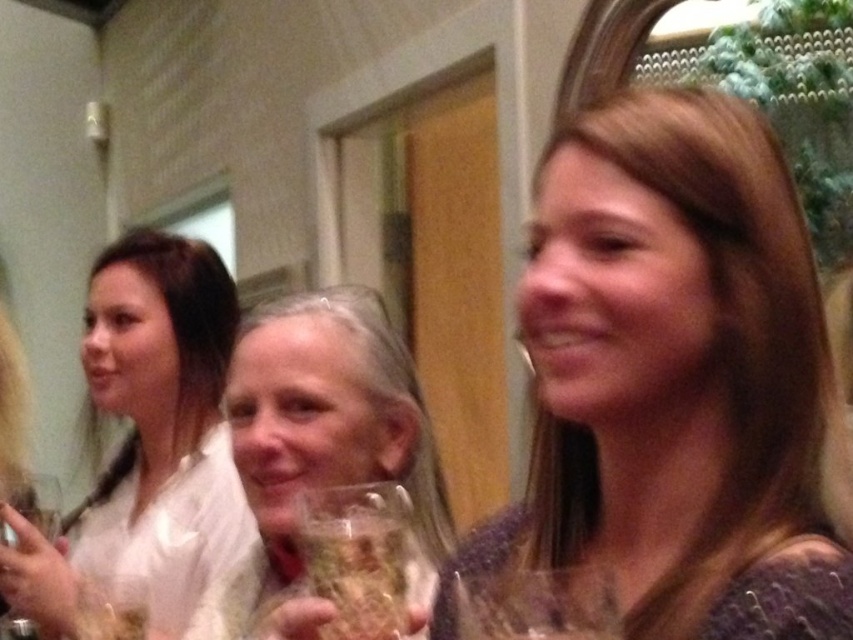
You are a photographer adjusting the lighting in this scene. You notice the matte white blouse at left and the translucent glass at center. Which object is closer to the camera based on their positions?

The matte white blouse at left is closer to the camera because it is positioned over the translucent glass at center.

You are a bartender preparing drinks and need to choose between the translucent glass at center and the clear glass wine glass at lower left. Which glass has a larger diameter?

The translucent glass at center has a larger diameter than the clear glass wine glass at lower left.

You are at a party and want to pour a drink into the tallest glass available. Which one should you choose between the translucent glass at center and the clear glass wine glass at center?

The translucent glass at center is much taller than the clear glass wine glass at center, so you should choose the translucent glass at center to pour your drink.